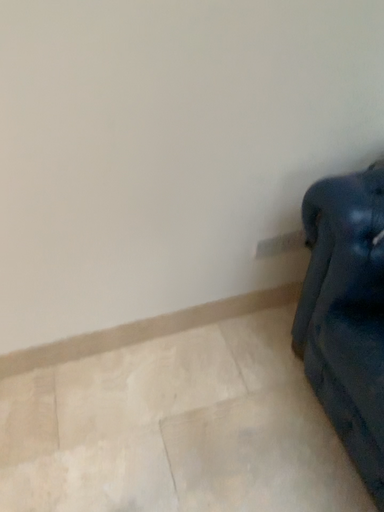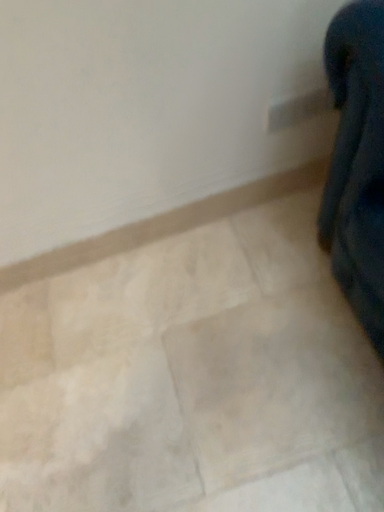
Question: How did the camera likely rotate when shooting the video?

Choices:
 (A) rotated downward
 (B) rotated upward

Answer: (A)